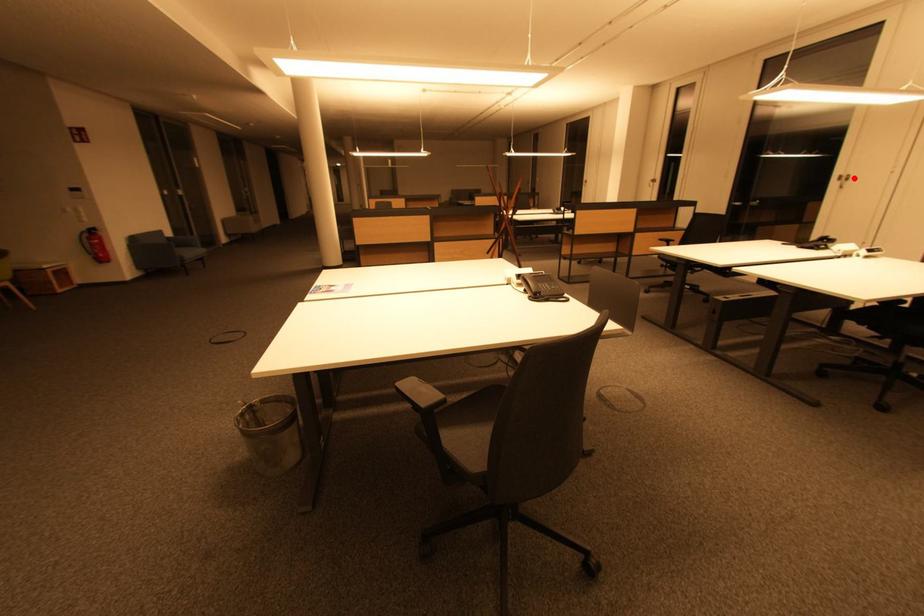
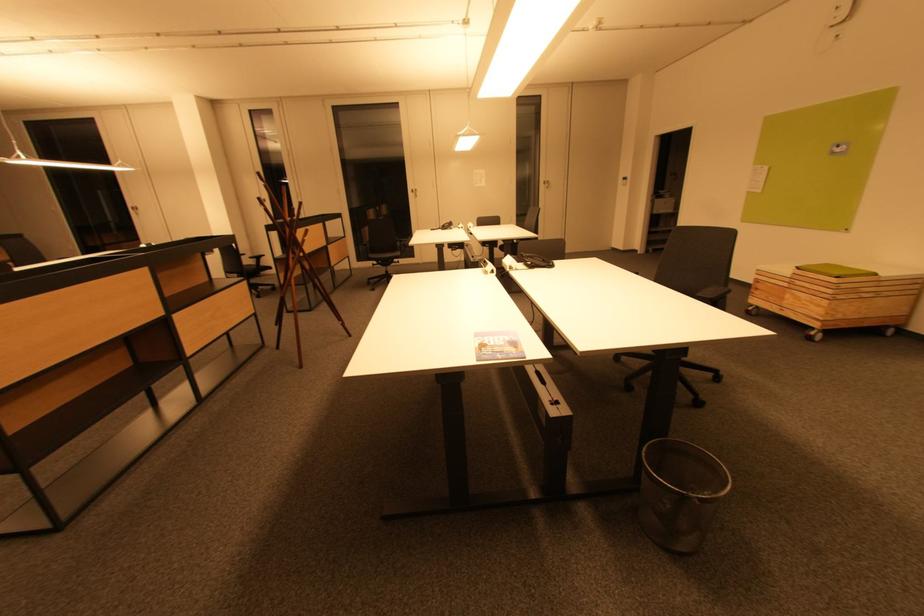
In the second image, find the point that corresponds to the highlighted location in the first image.

(419, 191)